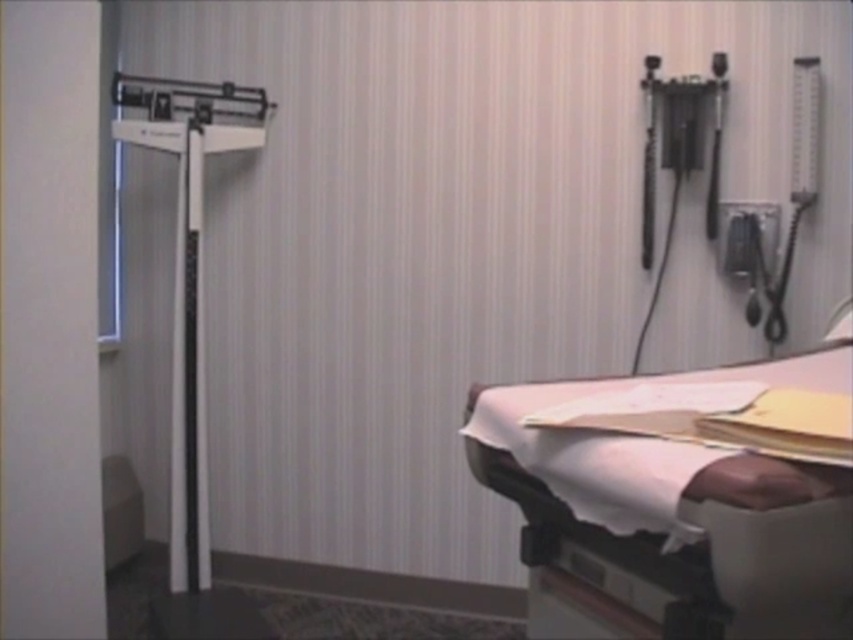
You are a patient in a hospital room and need to get to the white fabric hospital bed at lower right. From your current position, which direction should you move to reach it?

The white fabric hospital bed at lower right is located at point [670,518], so you should move towards the lower right direction to reach it.

You are a patient who needs to weigh yourself using the white plastic scale at left. You see the white fabric hospital bed at lower right nearby. Is the bed positioned above or below the scale?

The white fabric hospital bed at lower right is below the white plastic scale at left.